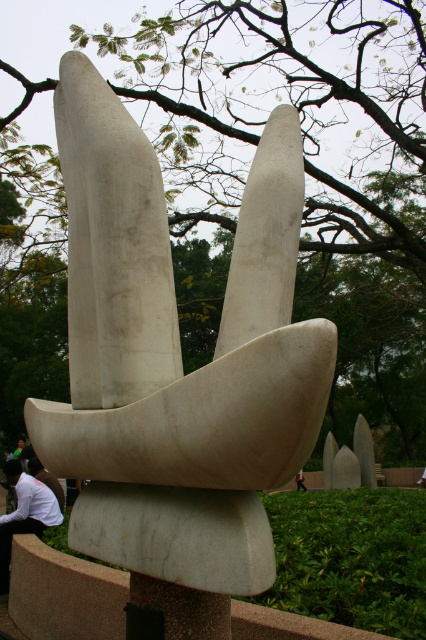
Does point (285, 324) come farther from viewer compared to point (37, 483)?

That is False.

Is white marble sculpture at center to the right of white shirt at lower left from the viewer's perspective?

Yes, white marble sculpture at center is to the right of white shirt at lower left.

Is point (83, 394) positioned in front of point (37, 490)?

Yes, point (83, 394) is closer to viewer.

What are the coordinates of `white marble sculpture at center` in the screenshot? It's located at (176, 356).